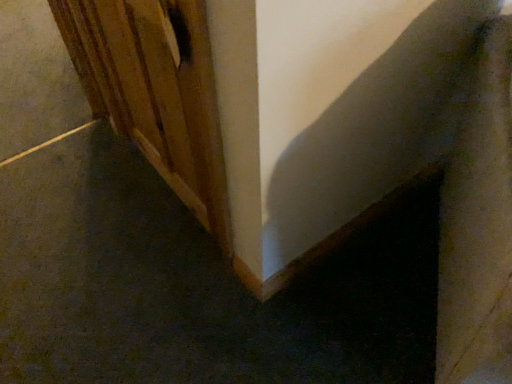
Question: In terms of size, does wooden door at left appear bigger or smaller than smooth gray concrete at lower left?

Choices:
 (A) small
 (B) big

Answer: (A)

Question: From the image's perspective, relative to smooth gray concrete at lower left, is wooden door at left above or below?

Choices:
 (A) above
 (B) below

Answer: (B)

Question: Is point (192, 84) closer or farther from the camera than point (64, 67)?

Choices:
 (A) closer
 (B) farther

Answer: (A)

Question: Considering their positions, is smooth gray concrete at lower left located in front of or behind wooden door at left?

Choices:
 (A) behind
 (B) front

Answer: (A)

Question: Is smooth gray concrete at lower left spatially inside wooden door at left, or outside of it?

Choices:
 (A) outside
 (B) inside

Answer: (A)

Question: Would you say smooth gray concrete at lower left is to the left or to the right of wooden door at left in the picture?

Choices:
 (A) right
 (B) left

Answer: (B)

Question: Is smooth gray concrete at lower left bigger or smaller than wooden door at left?

Choices:
 (A) big
 (B) small

Answer: (A)